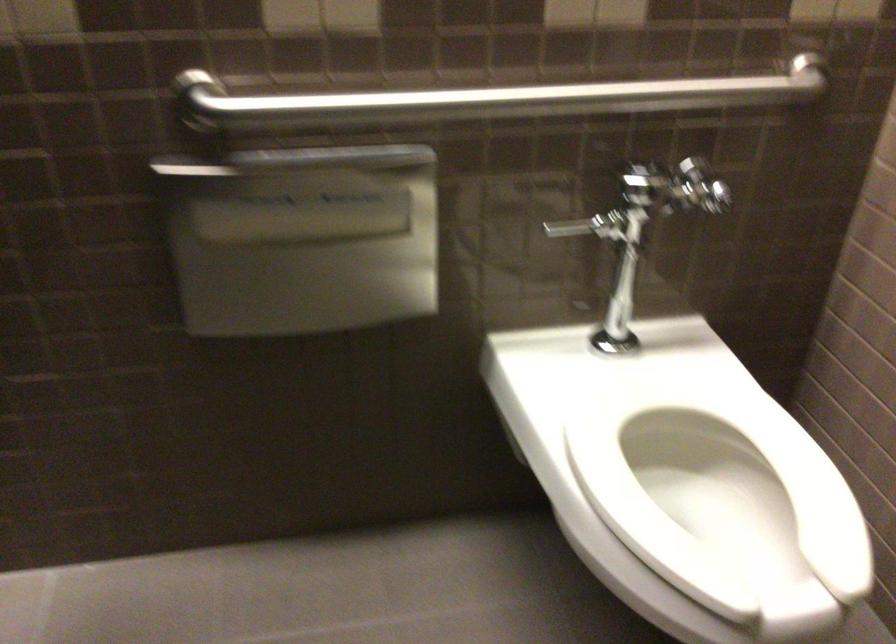
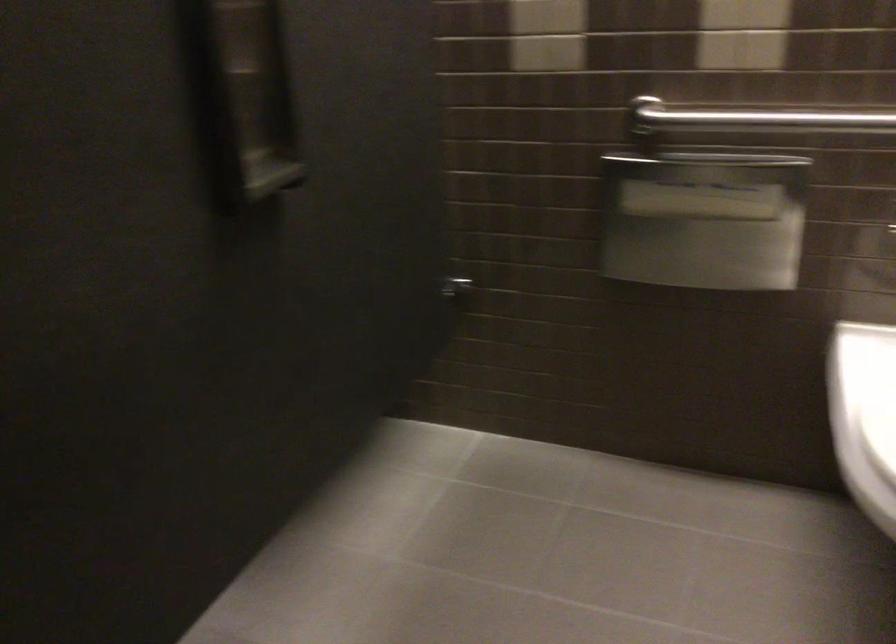
Question: The camera is either moving clockwise (left) or counter-clockwise (right) around the object. The first image is from the beginning of the video and the second image is from the end. Is the camera moving left or right when shooting the video?

Choices:
 (A) Left
 (B) Right

Answer: (B)